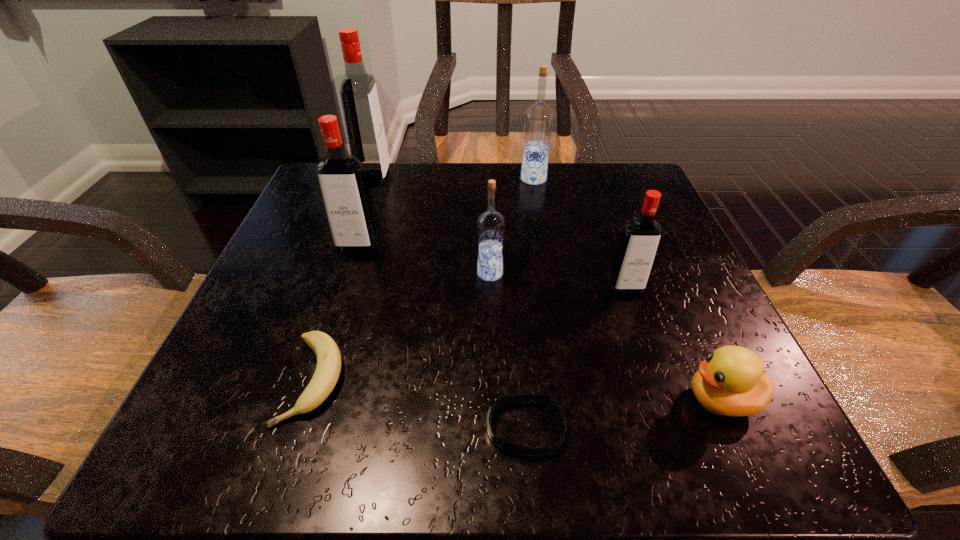
Where is `vodka that is the nearest to the smallest red vodka`? vodka that is the nearest to the smallest red vodka is located at coordinates (491, 224).

This screenshot has height=540, width=960. Identify the location of vodka that is the third closest to the duckling. (538, 119).

This screenshot has width=960, height=540. Identify the location of red vodka that is the third closest to the bigger blue vodka. pyautogui.click(x=341, y=179).

Select which red vodka appears as the closest to the sixth tallest object. Please provide its 2D coordinates. Your answer should be formatted as a tuple, i.e. [(x, y)], where the tuple contains the x and y coordinates of a point satisfying the conditions above.

[(640, 238)]

Where is `free point that satisfies the following two spatial constraints: 1. on the front and back of the third vodka from right to left; 2. on the left side of the tallest object`? This screenshot has width=960, height=540. free point that satisfies the following two spatial constraints: 1. on the front and back of the third vodka from right to left; 2. on the left side of the tallest object is located at coordinates (343, 273).